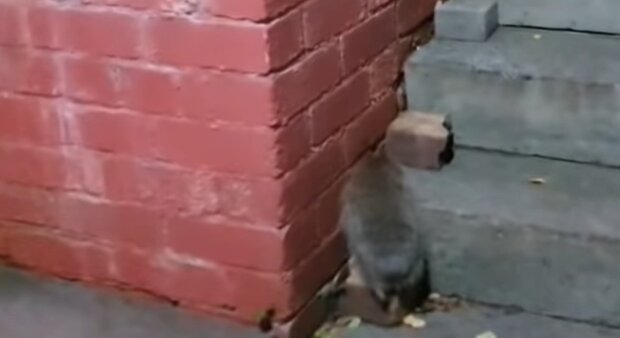
Where is `floor`? The height and width of the screenshot is (338, 620). floor is located at coordinates (510, 328), (209, 325).